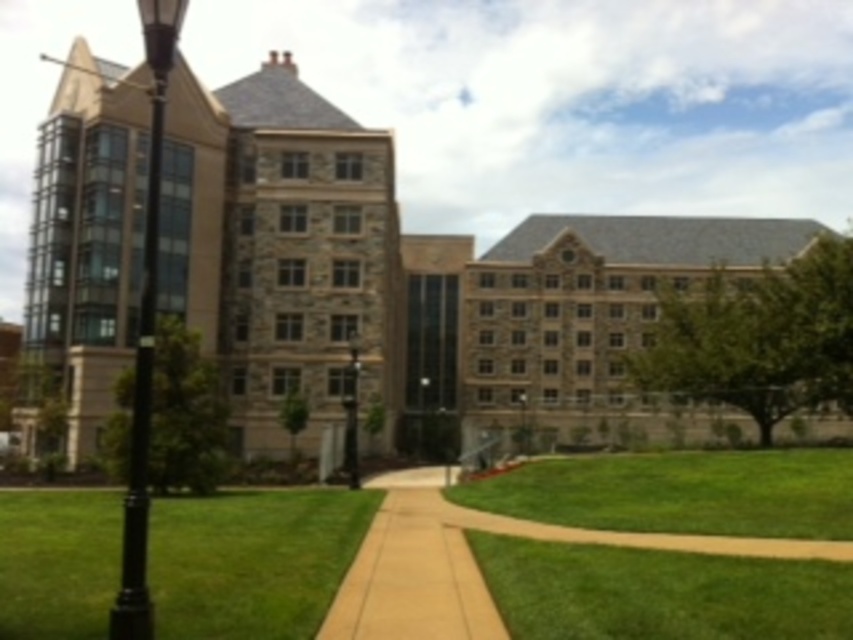
Question: Considering the real-world distances, which object is closest to the beige concrete sidewalk at center?

Choices:
 (A) green grass at lower left
 (B) black polished metal lamp post at left
 (C) black metal lamp post at center

Answer: (A)

Question: Can you confirm if beige concrete sidewalk at center is wider than black polished metal lamp post at left?

Choices:
 (A) yes
 (B) no

Answer: (B)

Question: Does green grass at lower left have a greater width compared to black polished metal lamp post at left?

Choices:
 (A) yes
 (B) no

Answer: (A)

Question: Which point is farther from the camera taking this photo?

Choices:
 (A) (389, 630)
 (B) (233, 625)
 (C) (352, 397)

Answer: (C)

Question: Which point is closer to the camera taking this photo?

Choices:
 (A) (0, 572)
 (B) (372, 529)
 (C) (354, 477)
 (D) (154, 296)

Answer: (D)

Question: Does black polished metal lamp post at left have a lesser width compared to black metal lamp post at center?

Choices:
 (A) yes
 (B) no

Answer: (B)